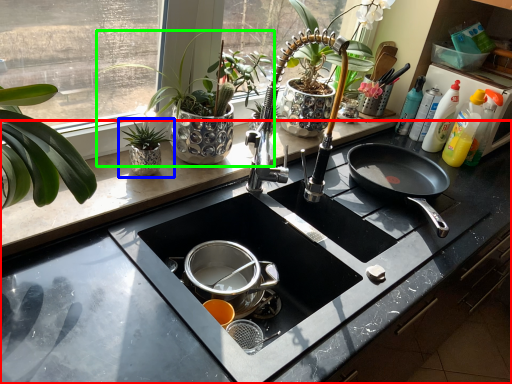
Question: Considering the real-world distances, which object is farthest from countertop (highlighted by a red box)? houseplant (highlighted by a blue box) or houseplant (highlighted by a green box)?

Choices:
 (A) houseplant
 (B) houseplant

Answer: (A)